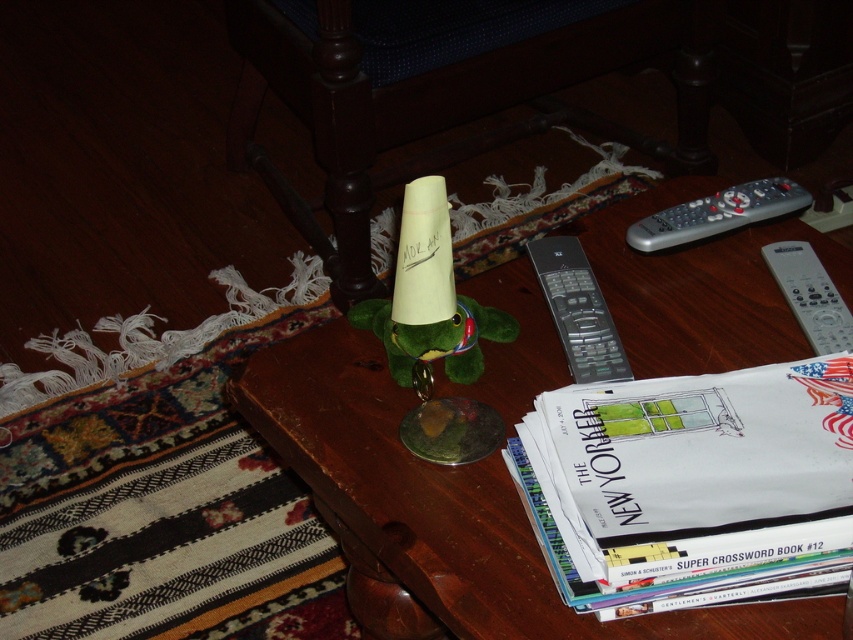
You are trying to reach for the remotes on the coffee table. Which remote, the black plastic remote at center or the silver metallic remote at upper right, is easier to grab without moving your hand much?

The black plastic remote at center is closer to the viewer than the silver metallic remote at upper right, so it is easier to grab without moving your hand much.

You are organizing items on a coffee table and need to place a new item between the white paper book at lower right and the silver metallic remote at upper right. Based on their positions, where should you place the new item to ensure it is between them?

The white paper book at lower right is in front of the silver metallic remote at upper right. Therefore, to place the new item between them, you should position it in front of the silver metallic remote at upper right but behind the white paper book at lower right.